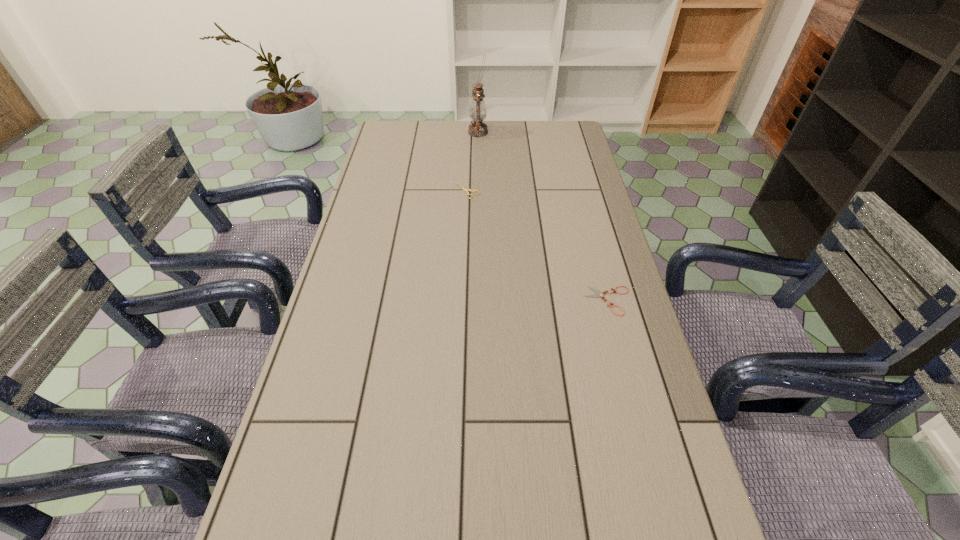
The height and width of the screenshot is (540, 960). Find the location of `oil lamp`. oil lamp is located at coordinates (477, 111).

I want to click on the farthest object, so click(477, 111).

You are a GUI agent. You are given a task and a screenshot of the screen. Output one action in this format:
    pyautogui.click(x=<x>, y=<y>)
    Task: Click on the left shears
    The height and width of the screenshot is (540, 960).
    Given the screenshot: What is the action you would take?
    pyautogui.click(x=466, y=190)

At what (x,y) coordinates should I click in order to perform the action: click on the farther shears. Please return your answer as a coordinate pair (x, y). Looking at the image, I should click on (466, 190).

Locate an element on the screen. Image resolution: width=960 pixels, height=540 pixels. the rightmost object is located at coordinates (599, 294).

I want to click on the nearer shears, so click(599, 294).

The image size is (960, 540). I want to click on vacant space located on the front of the tallest object, so click(478, 186).

The height and width of the screenshot is (540, 960). I want to click on vacant space located 0.290m on the right of the left shears, so click(564, 191).

Locate an element on the screen. The image size is (960, 540). free location located 0.240m on the back of the rightmost object is located at coordinates (589, 230).

Where is `object present at the far edge`? This screenshot has height=540, width=960. object present at the far edge is located at coordinates (477, 111).